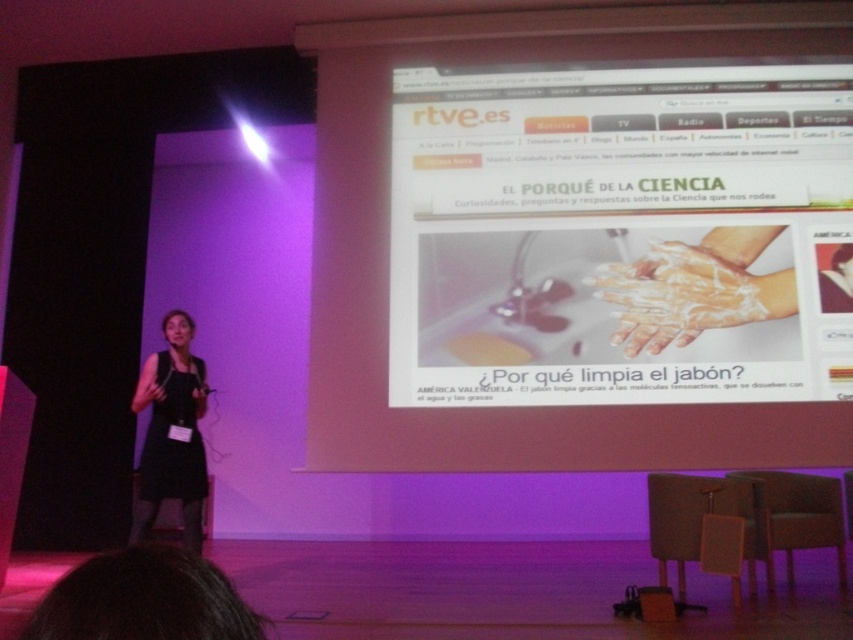
You are an attendee at the presentation and notice two points on the projection screen. The first point is labeled as point (581, 381) and the second is point (682, 336). Which point appears closer to you?

Point (581, 381) is closer to the viewer than point (682, 336).

You are standing in the audience of the presentation and want to point to a specific point on the screen. The point is labeled as point [595,138]. Given that you are 14.58 feet away from this point, can you accurately reach it with your finger without moving closer?

The point [595,138] is 14.58 feet away from the viewer. Since this distance is quite large, reaching it with your finger without moving closer would not be possible as your arm length is much shorter than 14.58 feet.

You are an attendee at the presentation and notice the white foamy hands at center and the black fabric dress at lower left. Which object is located to the right of the other?

The white foamy hands at center is positioned on the right side of black fabric dress at lower left.